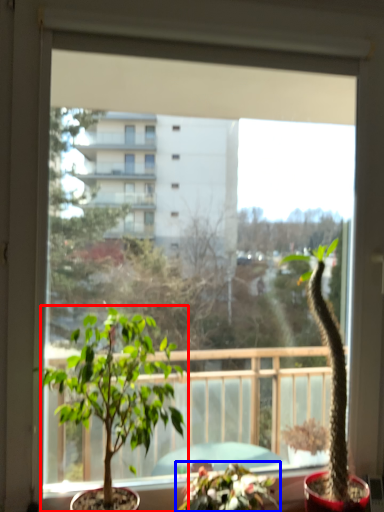
Question: Which of the following is the farthest to the observer, houseplant (highlighted by a red box) or houseplant (highlighted by a blue box)?

Choices:
 (A) houseplant
 (B) houseplant

Answer: (B)